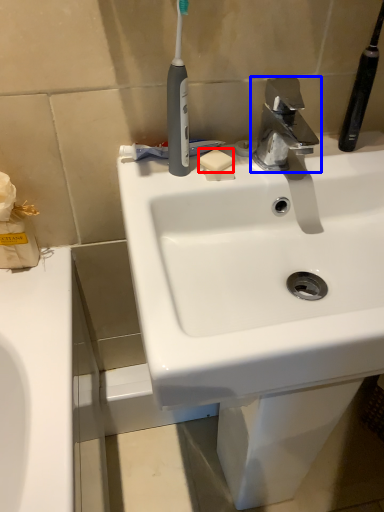
Question: Which object appears farthest to the camera in this image, soap (highlighted by a red box) or tap (highlighted by a blue box)?

Choices:
 (A) soap
 (B) tap

Answer: (A)